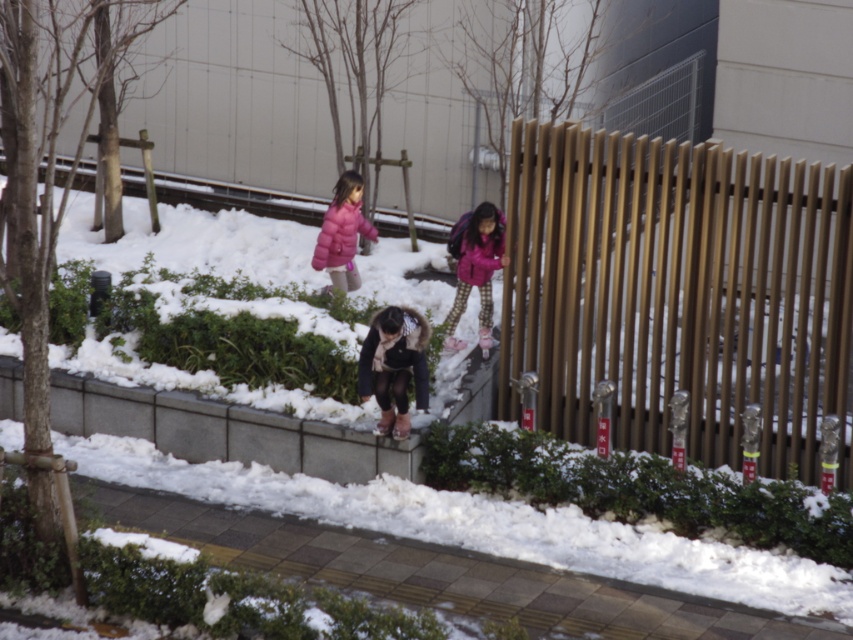
Question: Is matte black jacket at center further to camera compared to pink matte coat at upper center?

Choices:
 (A) yes
 (B) no

Answer: (B)

Question: Does brown wooden fence at right appear under matte pink jacket at center?

Choices:
 (A) yes
 (B) no

Answer: (A)

Question: Where is matte pink jacket at center located in relation to pink matte jacket at center in the image?

Choices:
 (A) right
 (B) left

Answer: (A)

Question: Which point is closer to the camera?

Choices:
 (A) pink matte coat at upper center
 (B) matte pink jacket at center
 (C) brown wooden fence at right

Answer: (C)

Question: Which point appears farthest from the camera in this image?

Choices:
 (A) (460, 248)
 (B) (331, 262)
 (C) (695, 246)
 (D) (476, 264)

Answer: (B)

Question: Among these points, which one is nearest to the camera?

Choices:
 (A) (456, 228)
 (B) (386, 349)

Answer: (B)